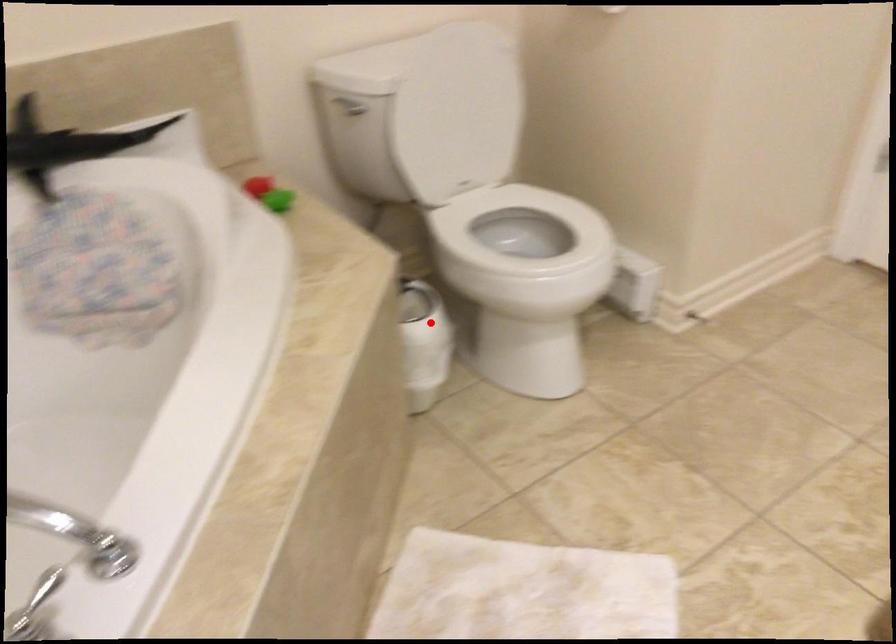
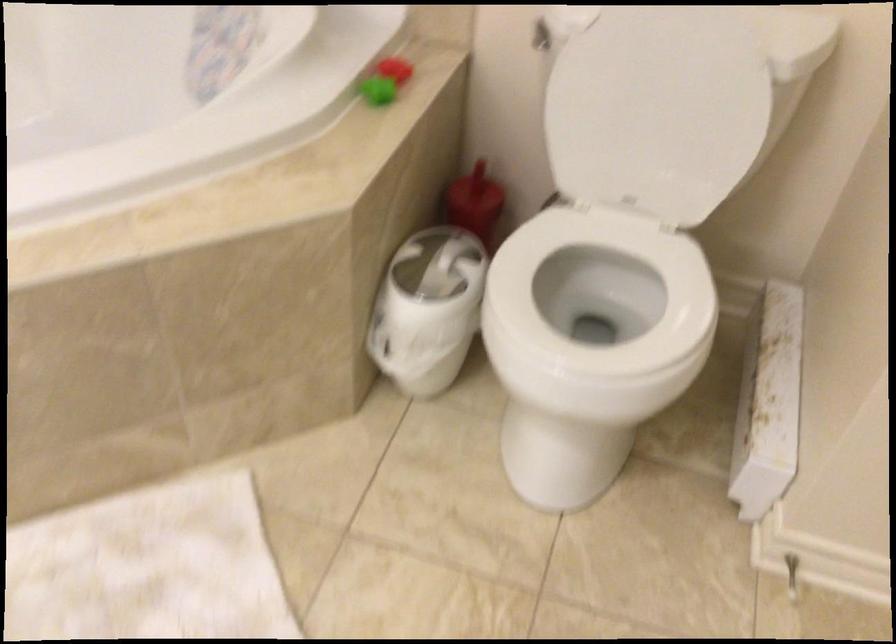
Question: I am providing you with two images of the same scene from different viewpoints. Image1 has a red point marked. In image2, the corresponding 3D location appears at what relative position? Reply with the corresponding letter.

Choices:
 (A) Closer
 (B) Farther

Answer: (A)